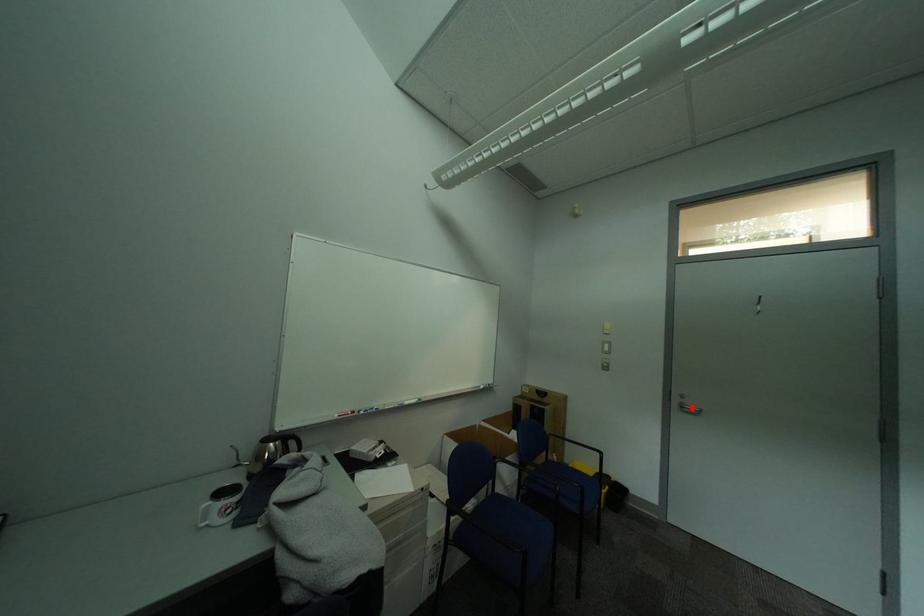
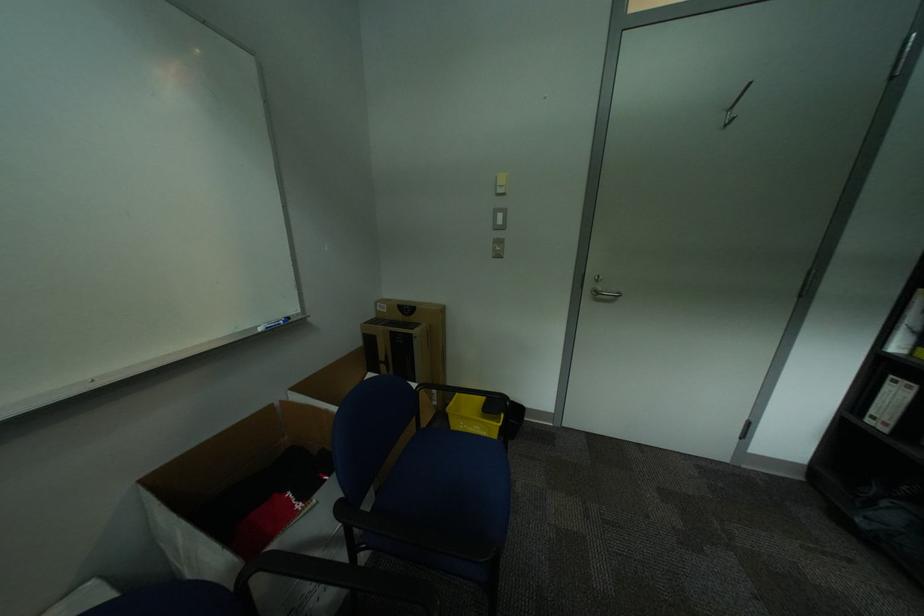
Locate, in the second image, the point that corresponds to the highlighted location in the first image.

(606, 294)